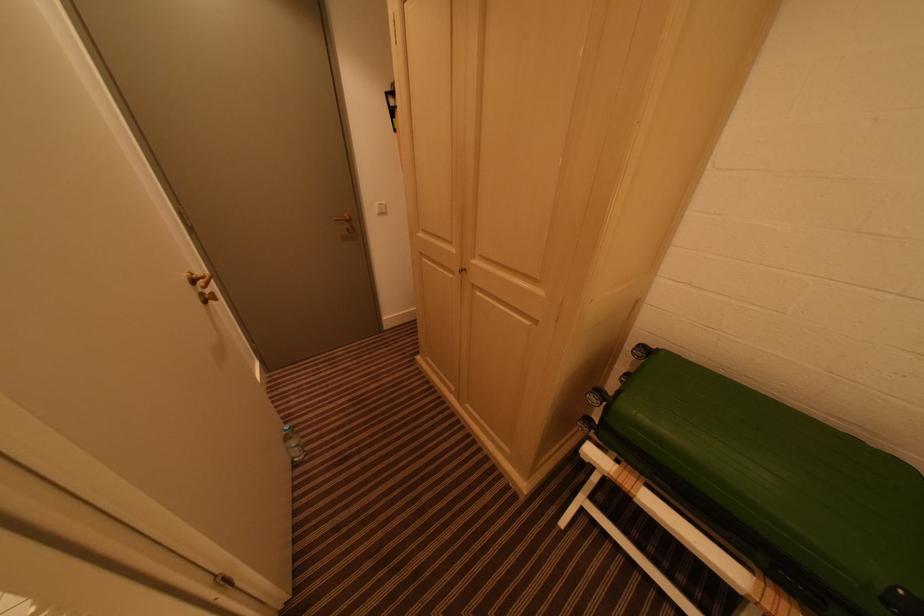
The width and height of the screenshot is (924, 616). Find the location of `white light switch`. white light switch is located at coordinates (381, 208).